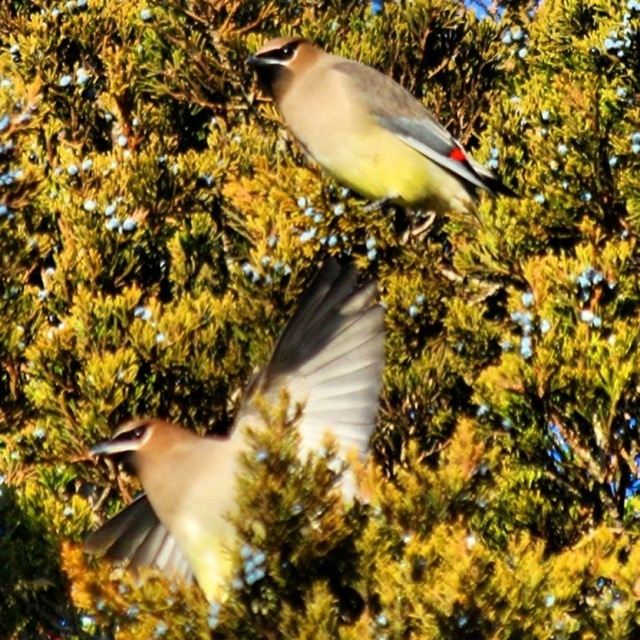
You are a birdwatcher trying to identify two Cedar Waxwings in the image. You notice a matte brown bird at center and a matte gray bird at upper center. Based on their height, which one is likely the adult bird?

The matte brown bird at center is much taller than the matte gray bird at upper center, so the matte brown bird at center is likely the adult bird.

You are a birdwatcher observing two Cedar Waxwings in a tree. You see the matte brown bird at center and the matte gray bird at upper center. Which bird is positioned to the left of the other?

The matte brown bird at center is positioned to the left of the matte gray bird at upper center.